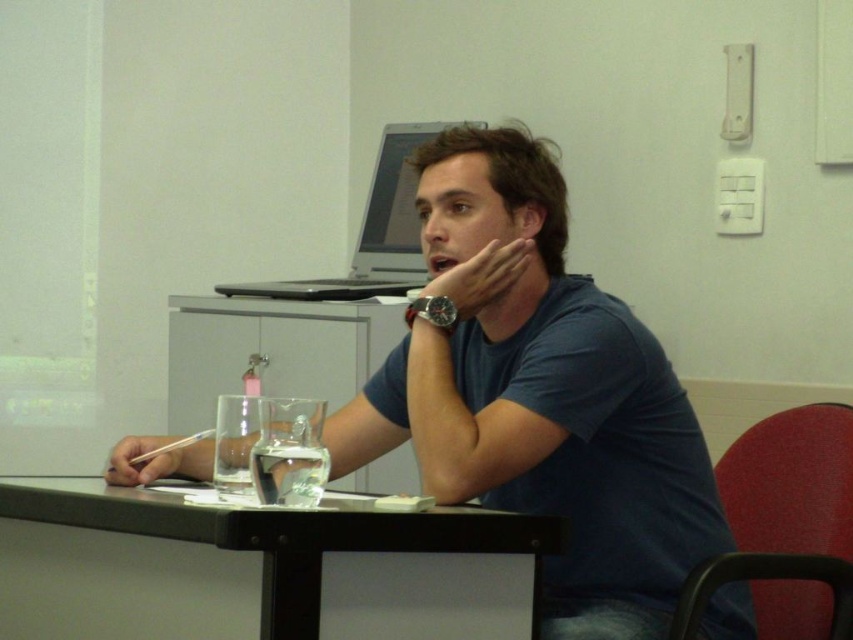
Consider the image. Can you confirm if matte black watch at center is positioned above matte plastic pen at lower left?

Yes, matte black watch at center is above matte plastic pen at lower left.

Does matte black watch at center have a greater width compared to matte plastic pen at lower left?

Yes.

The width and height of the screenshot is (853, 640). I want to click on matte black watch at center, so click(480, 276).

Is black matte table at lower center to the right of matte plastic pen at lower left from the viewer's perspective?

Yes, black matte table at lower center is to the right of matte plastic pen at lower left.

Identify the location of black matte table at lower center. This screenshot has height=640, width=853. pos(256,568).

The height and width of the screenshot is (640, 853). I want to click on black matte table at lower center, so click(x=256, y=568).

Locate an element on the screen. This screenshot has height=640, width=853. black matte table at lower center is located at coordinates (256, 568).

Does silver metallic laptop at upper center have a lesser height compared to matte plastic pen at lower left?

No, silver metallic laptop at upper center is not shorter than matte plastic pen at lower left.

Where is `silver metallic laptop at upper center`? silver metallic laptop at upper center is located at coordinates (372, 230).

Describe the element at coordinates (372, 230) in the screenshot. I see `silver metallic laptop at upper center` at that location.

Locate an element on the screen. silver metallic laptop at upper center is located at coordinates (372, 230).